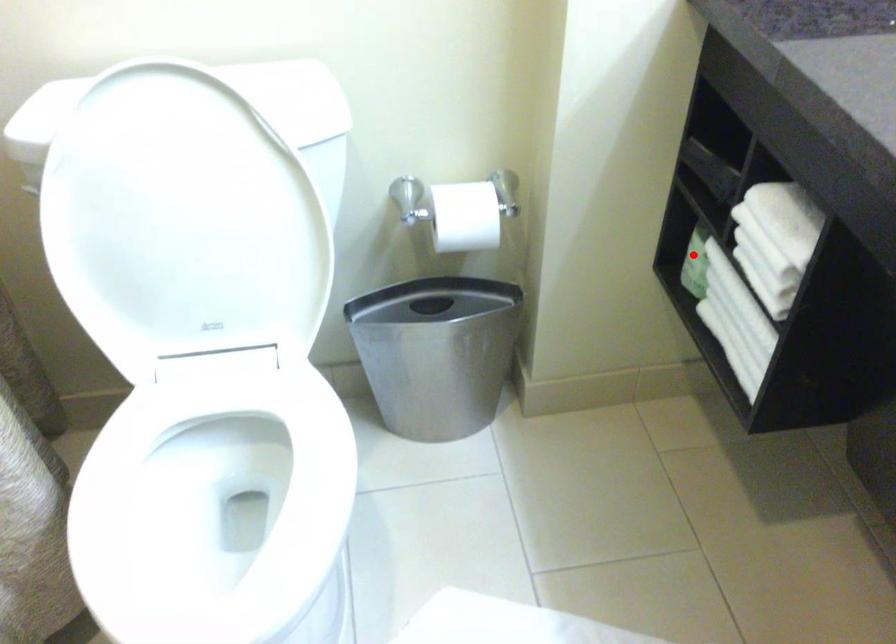
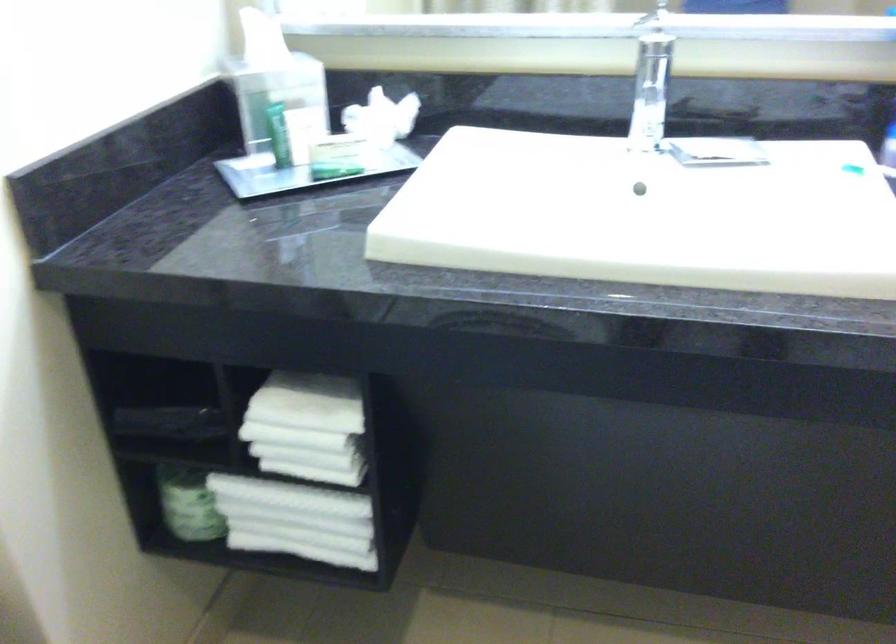
Find the pixel in the second image that matches the highlighted location in the first image.

(188, 504)